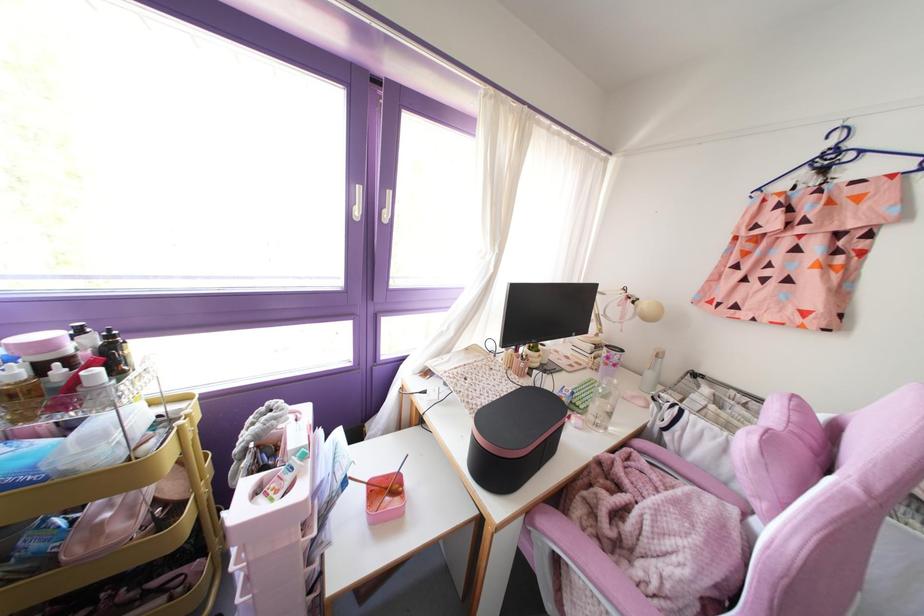
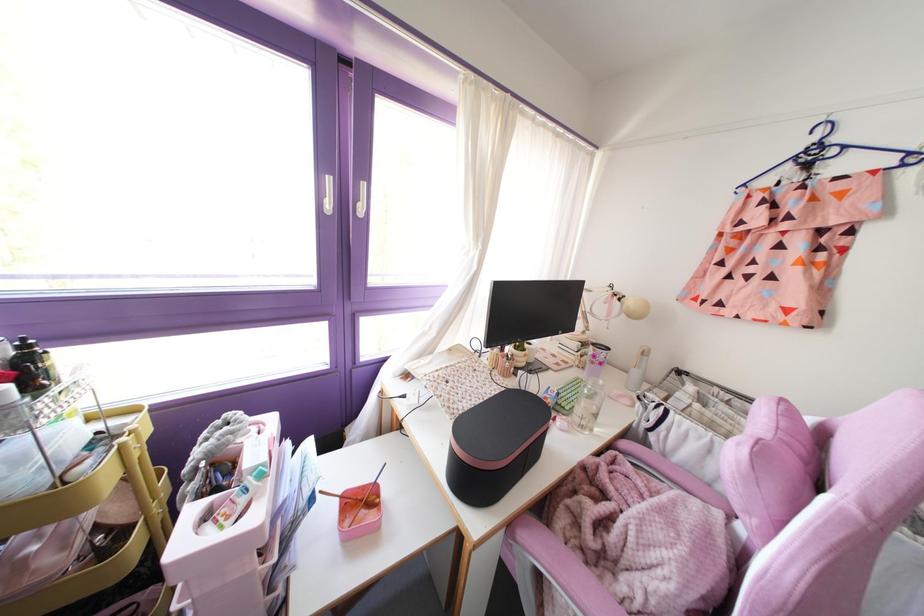
The point at (x=614, y=381) is marked in the first image. Where is the corresponding point in the second image?

(601, 382)